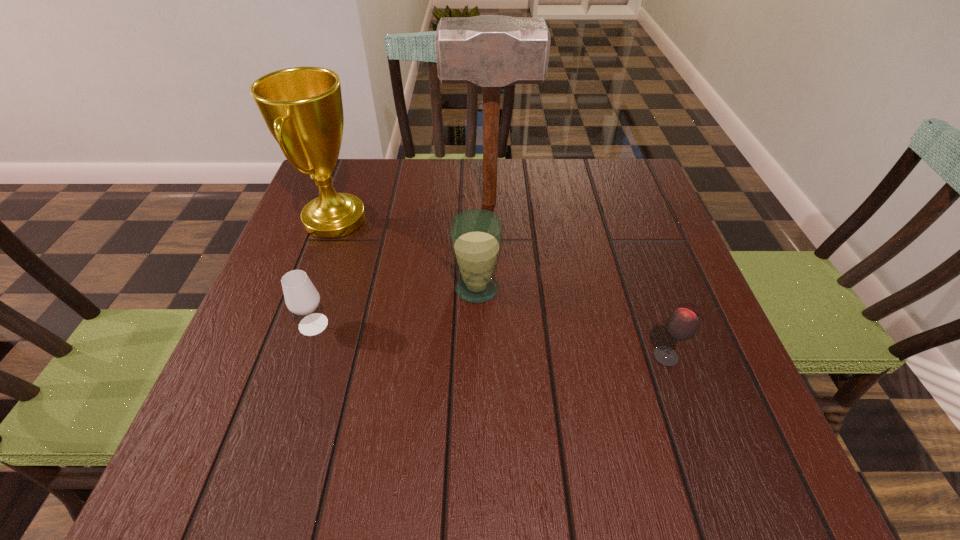
I want to click on vacant space that's between the fourth shortest object and the nearest object, so click(x=500, y=288).

Image resolution: width=960 pixels, height=540 pixels. I want to click on free space between the tallest object and the award, so click(412, 212).

The width and height of the screenshot is (960, 540). I want to click on free space between the award and the mallet, so click(x=412, y=212).

Where is `free spot between the leftmost glass and the award`? Image resolution: width=960 pixels, height=540 pixels. free spot between the leftmost glass and the award is located at coordinates (324, 272).

The height and width of the screenshot is (540, 960). Identify the location of vacant point located between the fourth shortest object and the nearest glass. (500, 288).

You are a GUI agent. You are given a task and a screenshot of the screen. Output one action in this format:
    pyautogui.click(x=<x>, y=<y>)
    Task: Click on the vacant area that lies between the second nearest object and the farthest glass
    This screenshot has height=540, width=960.
    Given the screenshot: What is the action you would take?
    pyautogui.click(x=396, y=307)

Select which object appears as the closest to the farthest glass. Please provide its 2D coordinates. Your answer should be formatted as a tuple, i.e. [(x, y)], where the tuple contains the x and y coordinates of a point satisfying the conditions above.

[(491, 51)]

This screenshot has height=540, width=960. Find the location of `object that stands as the second closest to the second tallest object`. object that stands as the second closest to the second tallest object is located at coordinates (491, 51).

Identify the location of glass that is the third closest to the second tallest object. (682, 324).

Find the location of a particular element. The image size is (960, 540). the third closest glass to the mallet is located at coordinates (682, 324).